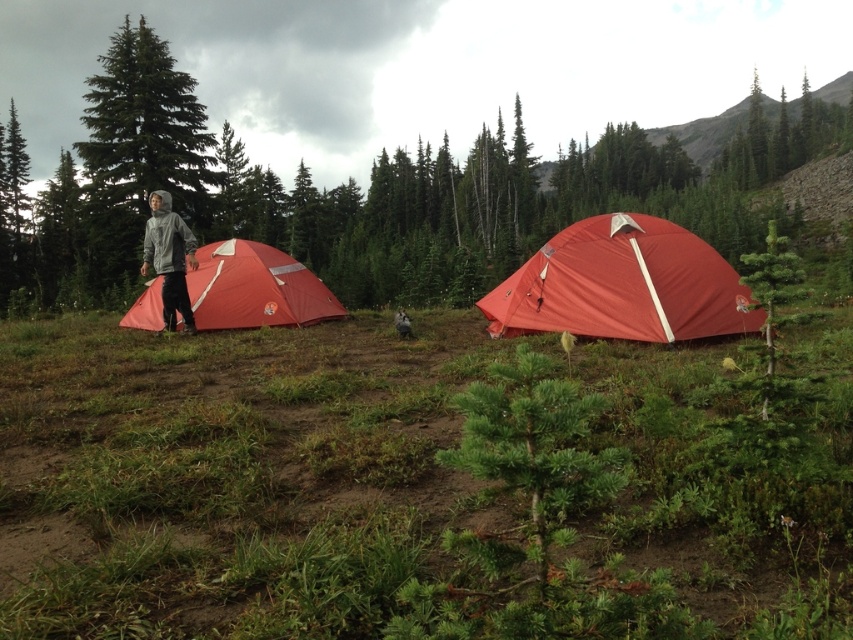
Question: Which point is closer to the camera?

Choices:
 (A) gray fleece jacket at left
 (B) matte red tent at left
 (C) matte red tent at center

Answer: (C)

Question: Observing the image, what is the correct spatial positioning of matte red tent at center in reference to gray fleece jacket at left?

Choices:
 (A) right
 (B) left

Answer: (A)

Question: Which of the following is the closest to the observer?

Choices:
 (A) matte red tent at left
 (B) matte red tent at center
 (C) gray fleece jacket at left

Answer: (B)

Question: Is matte red tent at left below gray fleece jacket at left?

Choices:
 (A) yes
 (B) no

Answer: (A)

Question: Estimate the real-world distances between objects in this image. Which object is farther from the matte red tent at center?

Choices:
 (A) gray fleece jacket at left
 (B) matte red tent at left

Answer: (A)

Question: Does matte red tent at left have a greater width compared to gray fleece jacket at left?

Choices:
 (A) no
 (B) yes

Answer: (B)